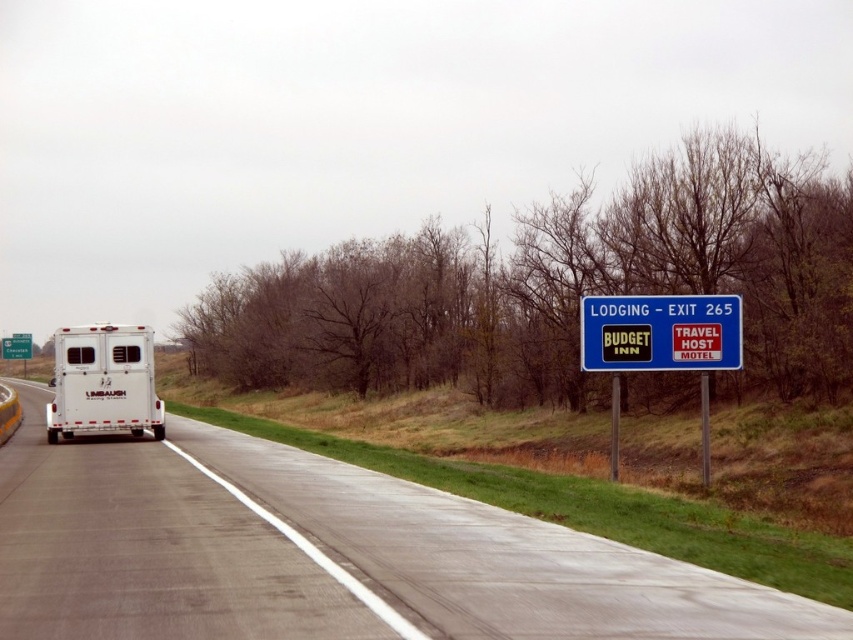
Question: From the image, what is the correct spatial relationship of gray asphalt highway at center in relation to blue plastic sign at right?

Choices:
 (A) left
 (B) right

Answer: (A)

Question: Which of the following is the farthest from the observer?

Choices:
 (A) blue plastic sign at right
 (B) white matte horse trailer at left
 (C) gray asphalt highway at center

Answer: (B)

Question: Does gray asphalt highway at center appear on the right side of blue plastic sign at right?

Choices:
 (A) no
 (B) yes

Answer: (A)

Question: Which object is farther from the camera taking this photo?

Choices:
 (A) white matte horse trailer at left
 (B) blue plastic sign at right
 (C) gray asphalt highway at center

Answer: (A)

Question: Among these objects, which one is farthest from the camera?

Choices:
 (A) white matte horse trailer at left
 (B) gray asphalt highway at center

Answer: (A)

Question: Is gray asphalt highway at center above blue plastic sign at right?

Choices:
 (A) no
 (B) yes

Answer: (A)